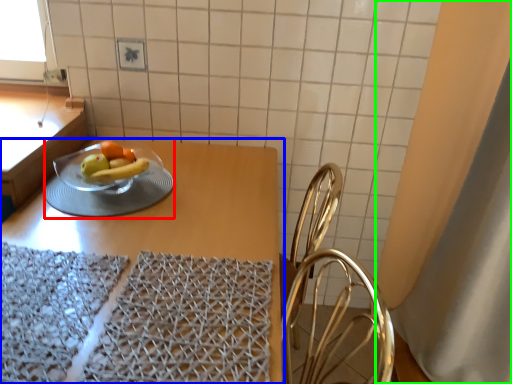
Question: Based on their relative distances, which object is farther from tableware (highlighted by a red box)? Choose from table (highlighted by a blue box) and curtain (highlighted by a green box).

Choices:
 (A) table
 (B) curtain

Answer: (B)